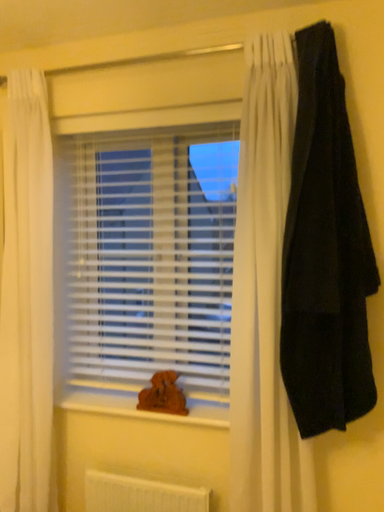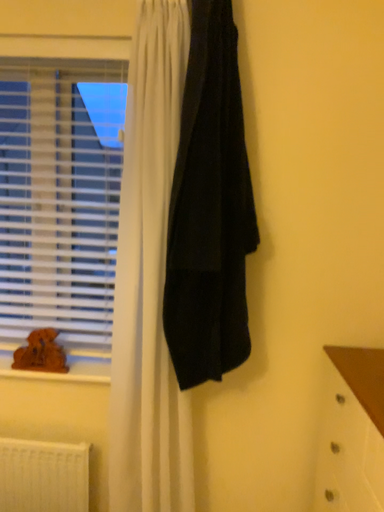
Question: Which way did the camera rotate in the video?

Choices:
 (A) rotated downward
 (B) rotated upward

Answer: (A)